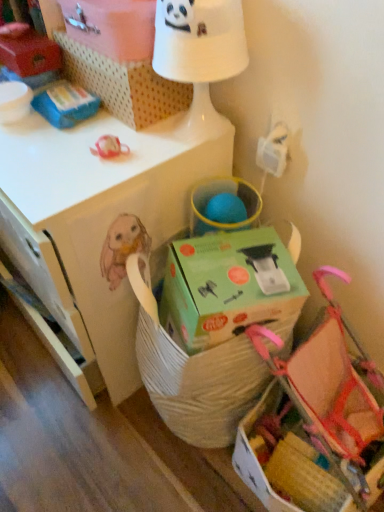
This screenshot has width=384, height=512. In order to click on free space to the left of white glossy table lamp at upper center in this screenshot , I will do `click(119, 144)`.